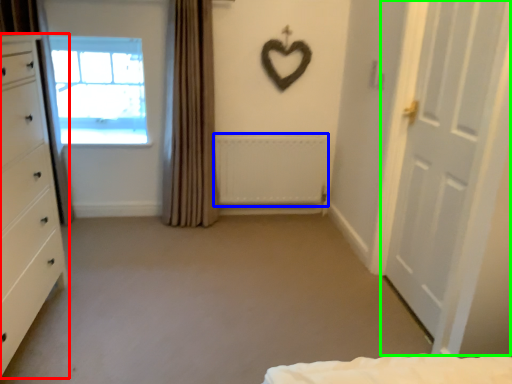
Question: Which object is the closest to the chest of drawers (highlighted by a red box)? Choose among these: radiator (highlighted by a blue box) or door (highlighted by a green box).

Choices:
 (A) radiator
 (B) door

Answer: (A)